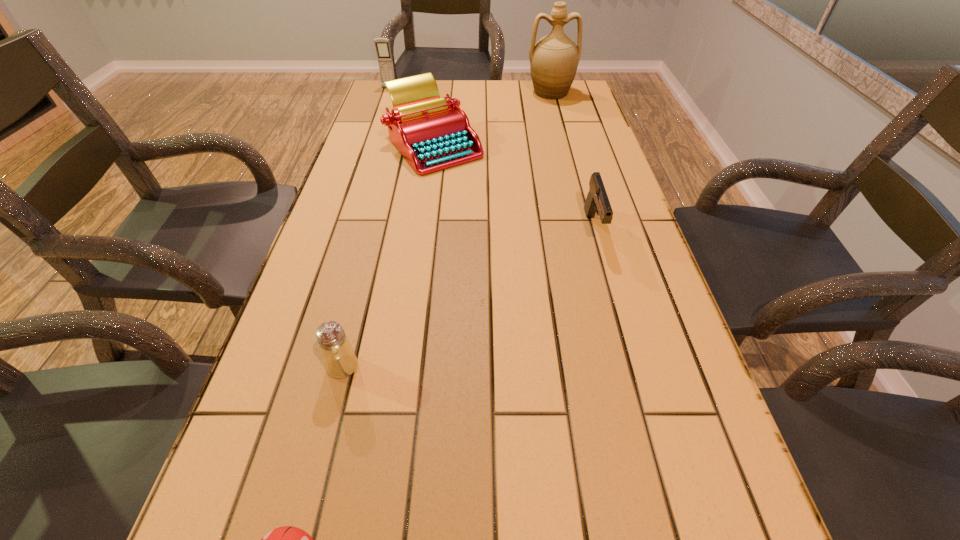
Locate an element on the screen. This screenshot has height=540, width=960. pitcher is located at coordinates (554, 59).

You are a GUI agent. You are given a task and a screenshot of the screen. Output one action in this format:
    pyautogui.click(x=<x>, y=<y>)
    Task: Click on the leftmost object
    This screenshot has height=540, width=960.
    Given the screenshot: What is the action you would take?
    pyautogui.click(x=382, y=45)

This screenshot has width=960, height=540. In order to click on the fourth shortest object in this screenshot , I will do click(x=432, y=133).

You are a GUI agent. You are given a task and a screenshot of the screen. Output one action in this format:
    pyautogui.click(x=<x>, y=<y>)
    Task: Click on the typewriter
    
    Given the screenshot: What is the action you would take?
    pyautogui.click(x=432, y=133)

Identify the location of pistol. The width and height of the screenshot is (960, 540). (597, 202).

Where is `saltshaker`? This screenshot has width=960, height=540. saltshaker is located at coordinates (340, 361).

The width and height of the screenshot is (960, 540). I want to click on vacant space situated on the front of the tallest object, so click(568, 161).

You are a GUI agent. You are given a task and a screenshot of the screen. Output one action in this format:
    pyautogui.click(x=<x>, y=<y>)
    Task: Click on the vacant region located 0.190m on the front-facing side of the leftmost object
    Image resolution: width=960 pixels, height=540 pixels.
    Given the screenshot: What is the action you would take?
    pyautogui.click(x=380, y=113)

Identify the location of free space located 0.110m on the typing side of the fourth nearest object. This screenshot has height=540, width=960. (426, 200).

You are a GUI agent. You are given a task and a screenshot of the screen. Output one action in this format:
    pyautogui.click(x=<x>, y=<y>)
    Task: Click on the vacant position located 0.050m aim along the barrel of the fourth farthest object
    The height and width of the screenshot is (540, 960).
    Given the screenshot: What is the action you would take?
    pyautogui.click(x=605, y=265)